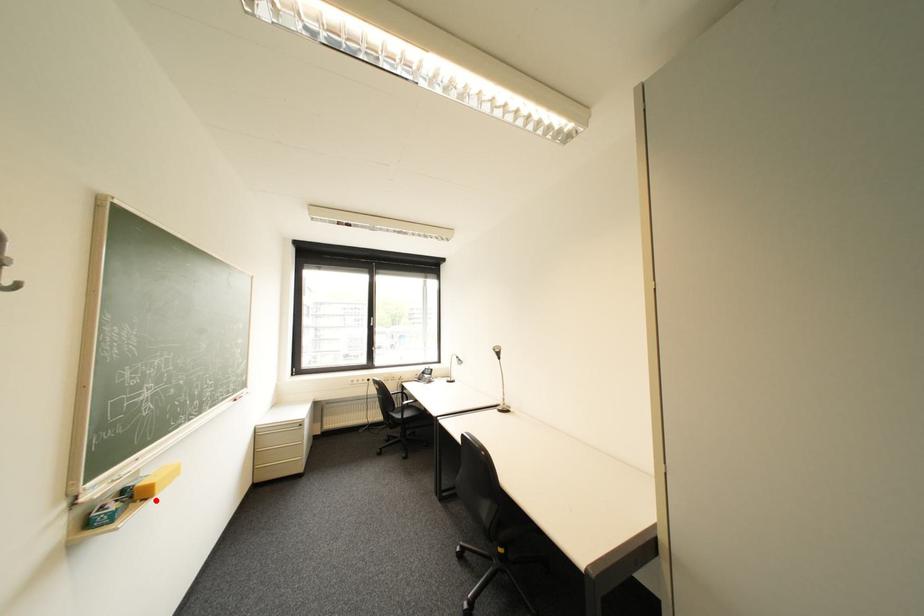
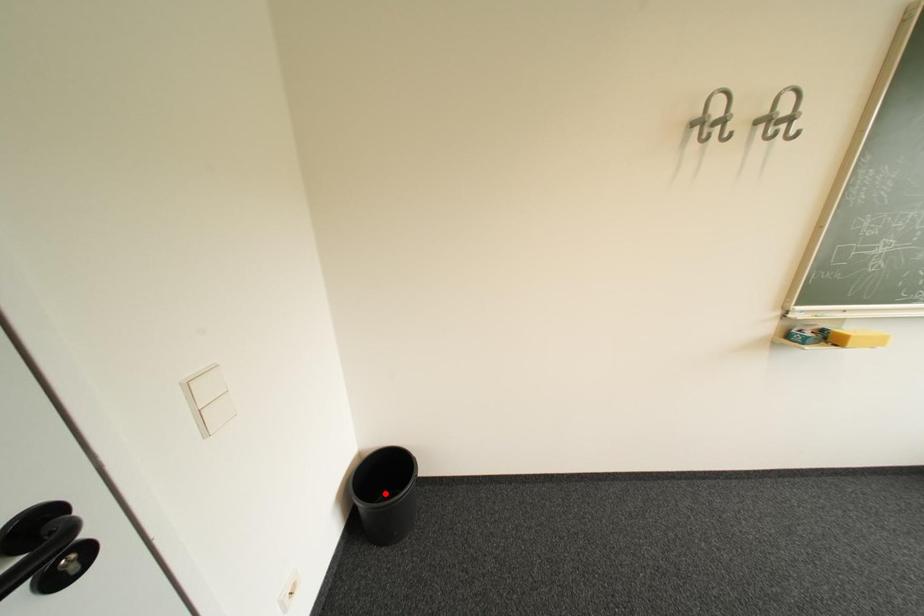
I am providing you with two images of the same scene from different viewpoints. A red point is marked on the first image and another point is marked on the second image. Are the points marked in image1 and image2 representing the same 3D position?

No